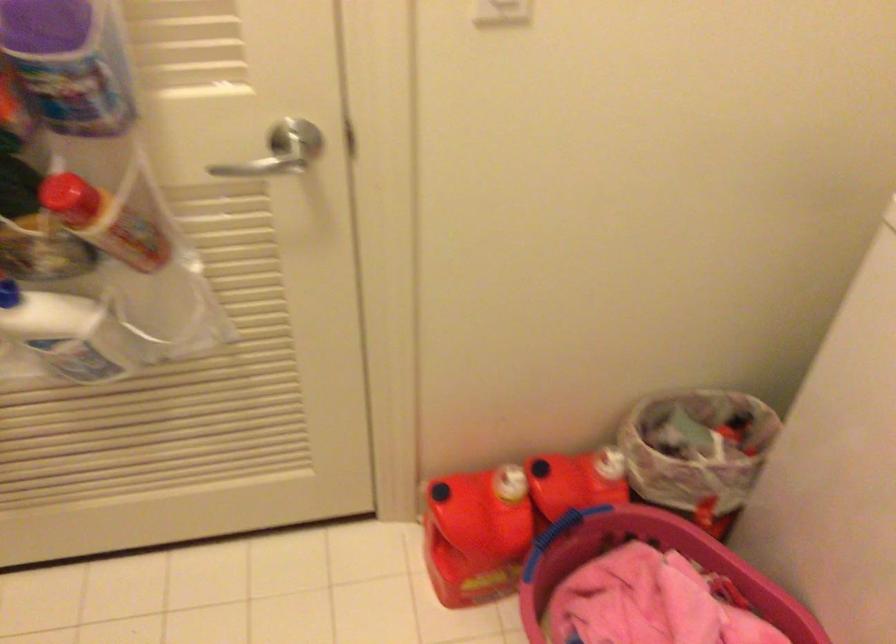
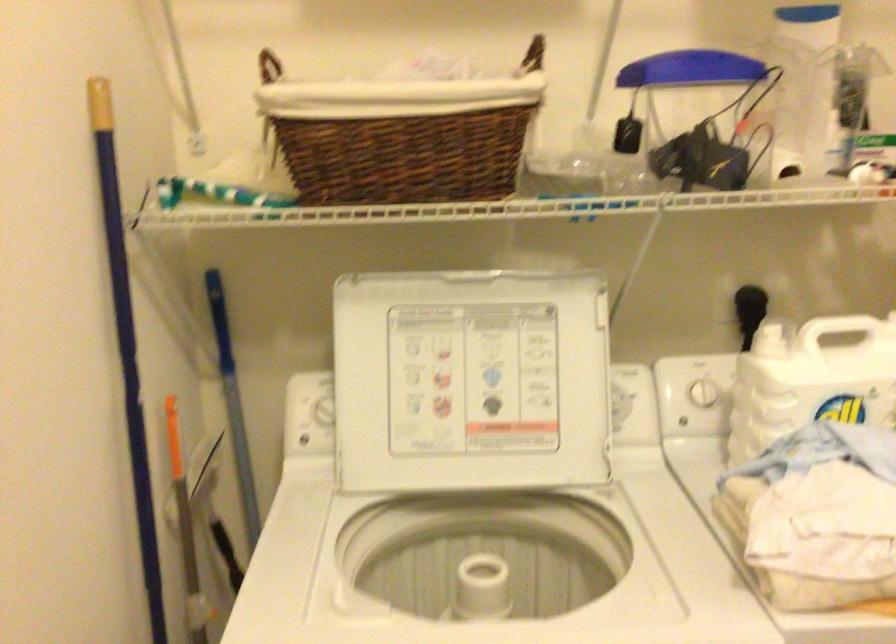
Question: The first image is from the beginning of the video and the second image is from the end. How did the camera likely rotate when shooting the video?

Choices:
 (A) Left
 (B) Right
 (C) Up
 (D) Down

Answer: (B)